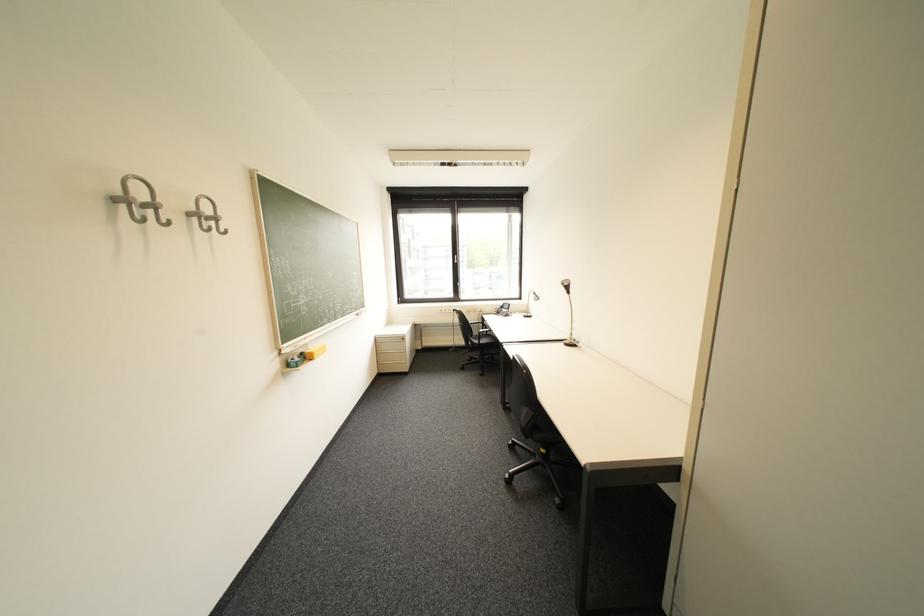
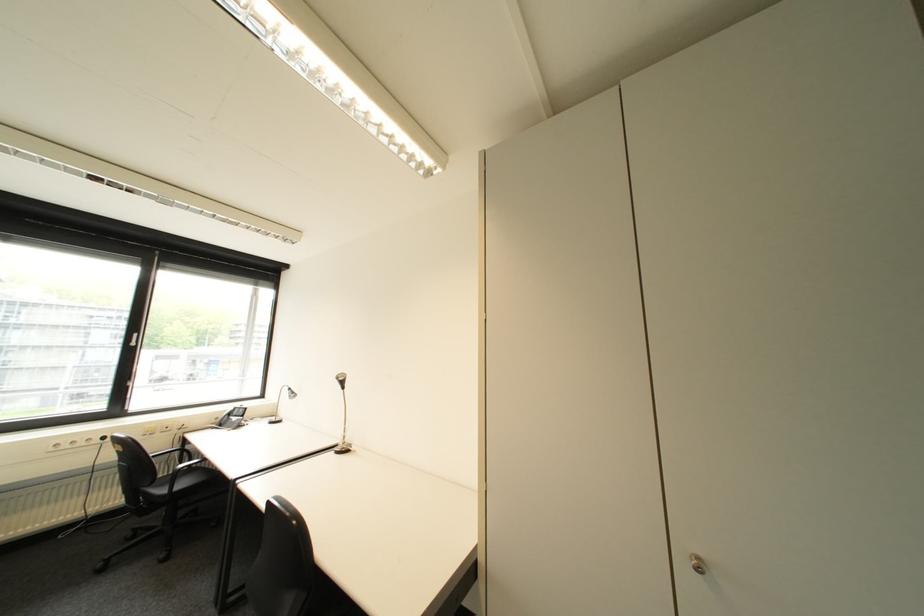
In the second image, find the point that corresponds to the point at 465,310 in the first image.

(114, 439)